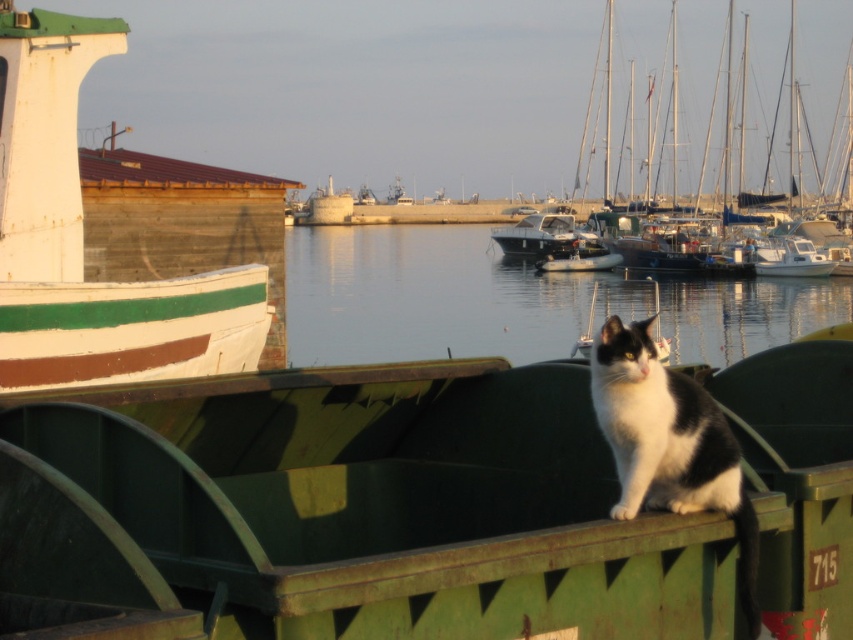
From the picture: You are standing at the edge of the marina and see a green matte boat at center. Can you confirm if the boat is positioned exactly at the coordinates point [349,509]?

The green matte boat at center is located at point [349,509].

Based on the scene description, where is the smooth water at center located in terms of coordinates?

The smooth water at center is located at coordinates point (x=433, y=298).